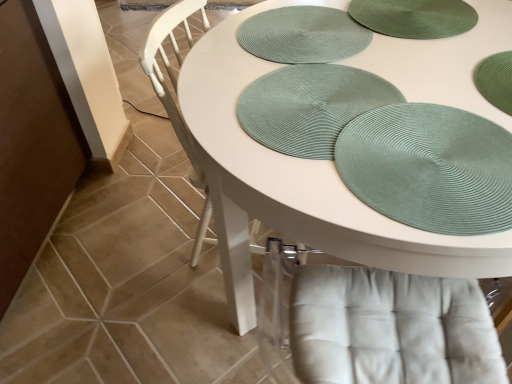
At what (x,y) coordinates should I click in order to perform the action: click on vacant space behind green textured placemat at upper right. Please return your answer as a coordinate pair (x, y). This screenshot has height=384, width=512. Looking at the image, I should click on (390, 77).